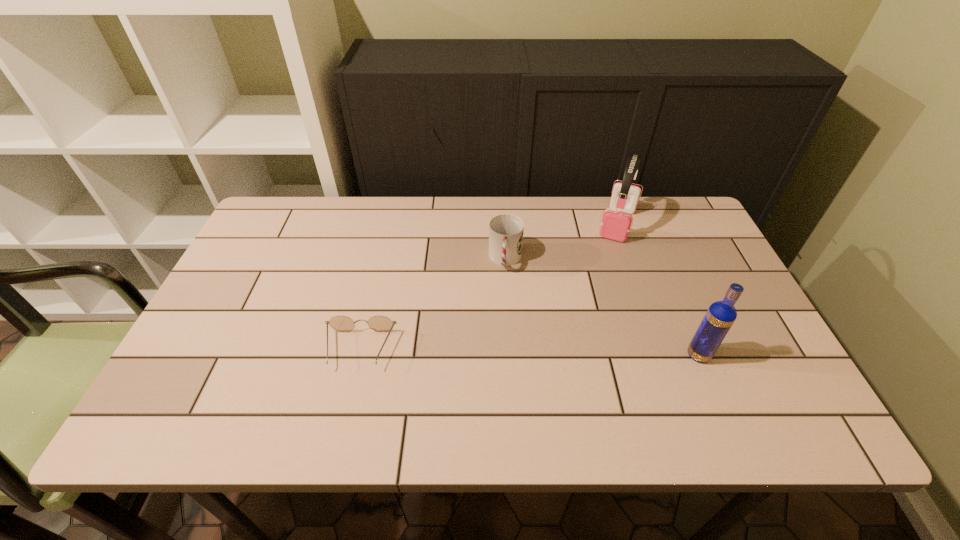
You are a GUI agent. You are given a task and a screenshot of the screen. Output one action in this format:
    pyautogui.click(x=<x>, y=<y>)
    Task: Click on the empty location between the third object from right to left and the vodka
    
    Given the screenshot: What is the action you would take?
    pyautogui.click(x=602, y=307)

This screenshot has height=540, width=960. In order to click on vacant space in between the earphone and the second object from left to right in this screenshot , I will do `click(562, 241)`.

Image resolution: width=960 pixels, height=540 pixels. Identify the location of unoccupied position between the spectacles and the earphone. (489, 287).

In order to click on free space between the earphone and the shortest object in this screenshot , I will do `click(489, 287)`.

I want to click on free space between the earphone and the cup, so pos(562,241).

You are a GUI agent. You are given a task and a screenshot of the screen. Output one action in this format:
    pyautogui.click(x=<x>, y=<y>)
    Task: Click on the object that can be found as the closest to the vodka
    Image resolution: width=960 pixels, height=540 pixels.
    Given the screenshot: What is the action you would take?
    pyautogui.click(x=616, y=222)

Point out which object is positioned as the third nearest to the second shortest object. Please provide its 2D coordinates. Your answer should be formatted as a tuple, i.e. [(x, y)], where the tuple contains the x and y coordinates of a point satisfying the conditions above.

[(720, 316)]

The width and height of the screenshot is (960, 540). What are the coordinates of `blank space that satisfies the following two spatial constraints: 1. on the front side of the vodka; 2. on the right side of the earphone` in the screenshot? It's located at (663, 355).

The width and height of the screenshot is (960, 540). I want to click on vacant region that satisfies the following two spatial constraints: 1. on the front-facing side of the leftmost object; 2. on the left side of the vodka, so click(358, 355).

Image resolution: width=960 pixels, height=540 pixels. What are the coordinates of `vacant space that satisfies the following two spatial constraints: 1. on the front-facing side of the vodka; 2. on the right side of the spectacles` in the screenshot? It's located at 358,355.